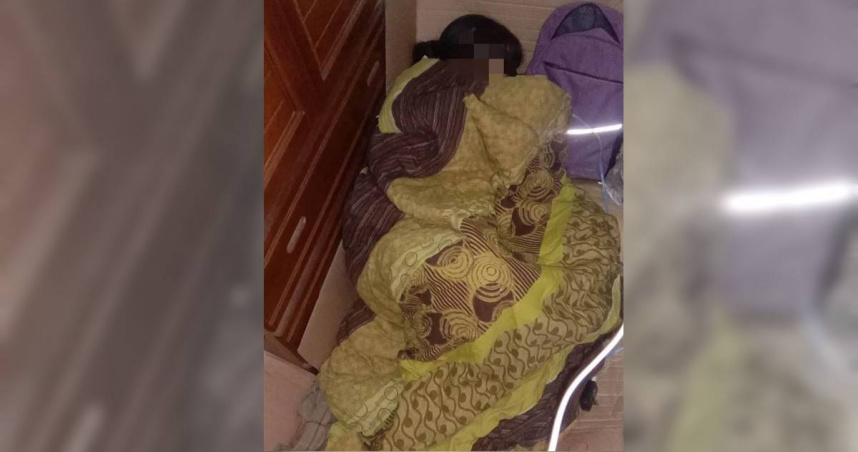
Find the location of a particular element. The width and height of the screenshot is (858, 452). blanket is located at coordinates (436, 259), (527, 359), (530, 271), (470, 117), (420, 141), (378, 359).